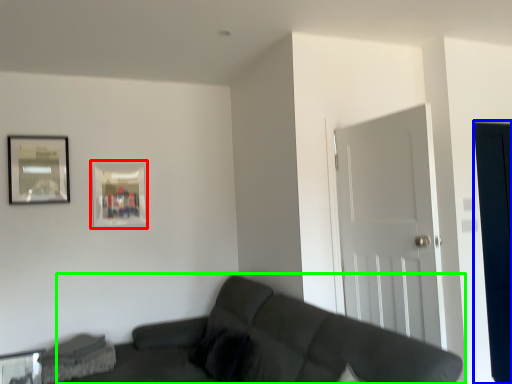
Question: Considering the real-world distances, which object is farthest from picture frame (highlighted by a red box)? glass door (highlighted by a blue box) or studio couch (highlighted by a green box)?

Choices:
 (A) glass door
 (B) studio couch

Answer: (A)